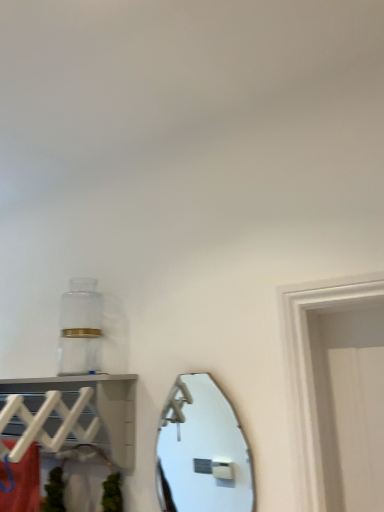
Question: Is white plastic shelf at upper left thinner than shiny silver mirror at center?

Choices:
 (A) yes
 (B) no

Answer: (B)

Question: Considering the relative sizes of white plastic shelf at upper left and shiny silver mirror at center in the image provided, is white plastic shelf at upper left taller than shiny silver mirror at center?

Choices:
 (A) yes
 (B) no

Answer: (B)

Question: From the image's perspective, is white plastic shelf at upper left beneath shiny silver mirror at center?

Choices:
 (A) no
 (B) yes

Answer: (A)

Question: Is white plastic shelf at upper left positioned beyond the bounds of shiny silver mirror at center?

Choices:
 (A) no
 (B) yes

Answer: (B)

Question: Does white plastic shelf at upper left come behind shiny silver mirror at center?

Choices:
 (A) no
 (B) yes

Answer: (A)

Question: From a real-world perspective, is white plastic shelf at upper left physically above shiny silver mirror at center?

Choices:
 (A) no
 (B) yes

Answer: (B)

Question: Is shiny silver mirror at center to the right of white plastic shelf at upper left from the viewer's perspective?

Choices:
 (A) no
 (B) yes

Answer: (B)

Question: Is shiny silver mirror at center oriented towards white plastic shelf at upper left?

Choices:
 (A) yes
 (B) no

Answer: (B)

Question: Does shiny silver mirror at center have a lesser height compared to white plastic shelf at upper left?

Choices:
 (A) yes
 (B) no

Answer: (B)

Question: Does shiny silver mirror at center have a greater width compared to white plastic shelf at upper left?

Choices:
 (A) no
 (B) yes

Answer: (A)

Question: Considering the relative sizes of shiny silver mirror at center and white plastic shelf at upper left in the image provided, is shiny silver mirror at center bigger than white plastic shelf at upper left?

Choices:
 (A) no
 (B) yes

Answer: (A)

Question: Is shiny silver mirror at center thinner than white plastic shelf at upper left?

Choices:
 (A) yes
 (B) no

Answer: (A)

Question: Would you say shiny silver mirror at center is inside or outside white plastic shelf at upper left?

Choices:
 (A) outside
 (B) inside

Answer: (A)